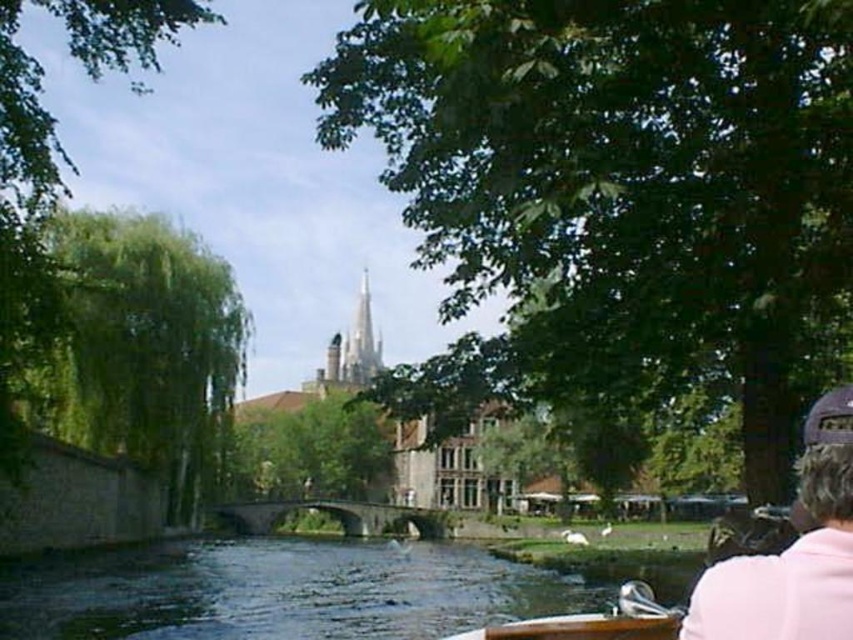
Between point (704, 580) and point (590, 627), which one is positioned behind?

Point (590, 627)

Who is lower down, pink fabric cap at upper right or wooden boat at lower center?

wooden boat at lower center is below.

Which is behind, point (808, 634) or point (641, 602)?

Point (641, 602)

This screenshot has height=640, width=853. What are the coordinates of `pink fabric cap at upper right` in the screenshot? It's located at (793, 552).

From the picture: Can you confirm if dark green water at lower center is shorter than wooden boat at lower center?

No.

The width and height of the screenshot is (853, 640). What do you see at coordinates (279, 592) in the screenshot?
I see `dark green water at lower center` at bounding box center [279, 592].

Describe the element at coordinates (279, 592) in the screenshot. This screenshot has height=640, width=853. I see `dark green water at lower center` at that location.

The image size is (853, 640). In order to click on dark green water at lower center in this screenshot , I will do point(279,592).

Can you confirm if dark green water at lower center is positioned to the left of pink fabric cap at upper right?

Correct, you'll find dark green water at lower center to the left of pink fabric cap at upper right.

Based on the photo, is dark green water at lower center bigger than pink fabric cap at upper right?

Correct, dark green water at lower center is larger in size than pink fabric cap at upper right.

This screenshot has width=853, height=640. I want to click on dark green water at lower center, so click(279, 592).